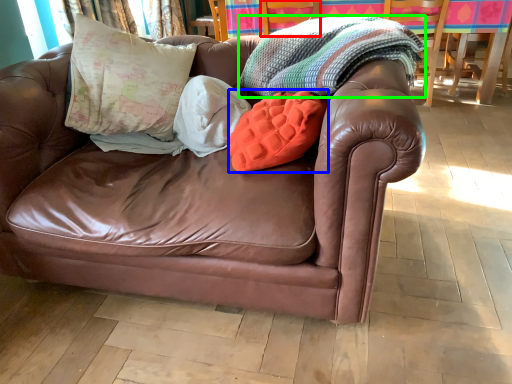
Question: Based on their relative distances, which object is farther from armchair (highlighted by a red box)? Choose from throw pillow (highlighted by a blue box) and blanket (highlighted by a green box).

Choices:
 (A) throw pillow
 (B) blanket

Answer: (A)